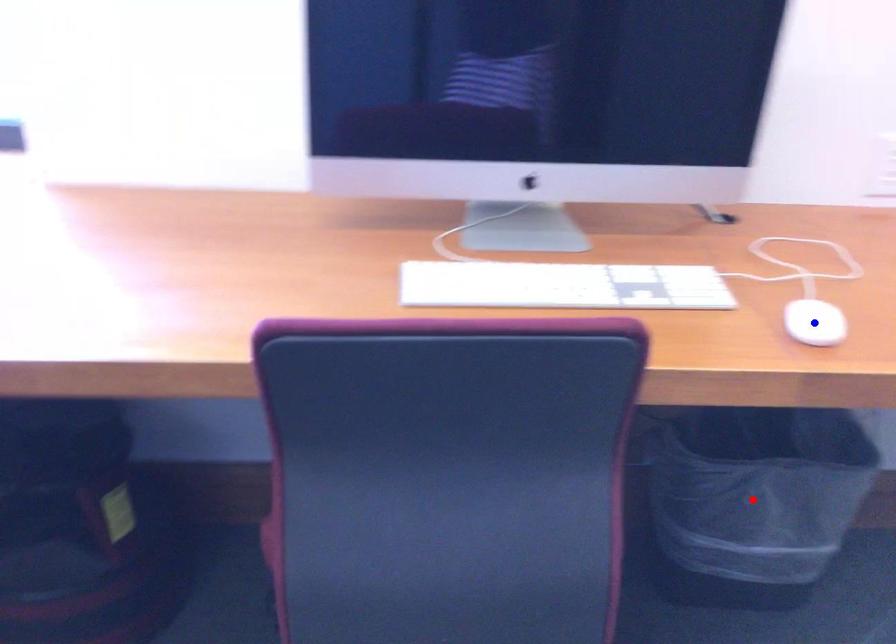
Question: In the image, two points are highlighted. Which point is nearer to the camera? Reply with the corresponding letter.

Choices:
 (A) blue point
 (B) red point

Answer: (A)